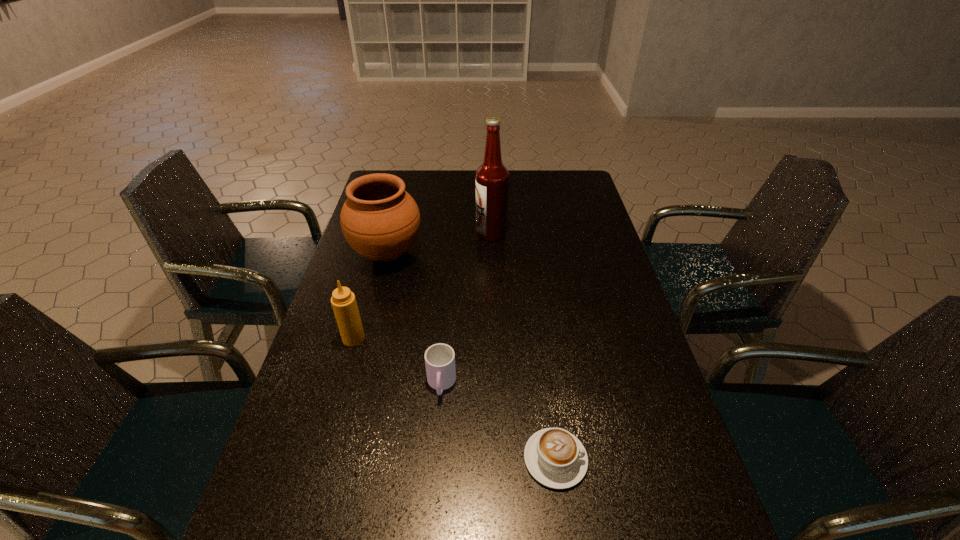
Identify the location of free region at the right edge. The image size is (960, 540). (641, 359).

Identify the location of free space between the fourth object from left to right and the cappuccino. (523, 346).

Where is `blank region between the third farthest object and the tallest object`? This screenshot has height=540, width=960. blank region between the third farthest object and the tallest object is located at coordinates (422, 286).

Locate an element on the screen. The width and height of the screenshot is (960, 540). vacant area that lies between the condiment and the tallest object is located at coordinates point(422,286).

Where is `free spot between the alcohol and the fourth shortest object`? Image resolution: width=960 pixels, height=540 pixels. free spot between the alcohol and the fourth shortest object is located at coordinates (439, 243).

The width and height of the screenshot is (960, 540). Identify the location of free point between the shortest object and the pottery. (471, 356).

Locate an element on the screen. This screenshot has height=540, width=960. vacant region between the shortest object and the condiment is located at coordinates (454, 399).

Image resolution: width=960 pixels, height=540 pixels. Find the location of `vacant region between the pottery and the third nearest object`. vacant region between the pottery and the third nearest object is located at coordinates (371, 296).

Image resolution: width=960 pixels, height=540 pixels. What are the coordinates of `vacant point located between the third farthest object and the third object from left to right` in the screenshot? It's located at (397, 361).

At what (x,y) coordinates should I click in order to perform the action: click on free space between the third object from left to right and the third tallest object. Please return your answer as a coordinate pair (x, y). Image resolution: width=960 pixels, height=540 pixels. Looking at the image, I should click on (397, 361).